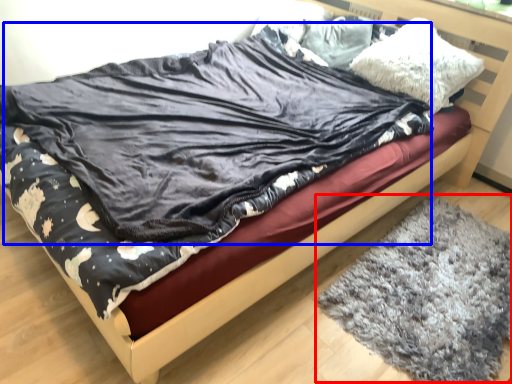
Question: Which point is closer to the camera, mat (highlighted by a red box) or blanket (highlighted by a blue box)?

Choices:
 (A) mat
 (B) blanket

Answer: (B)